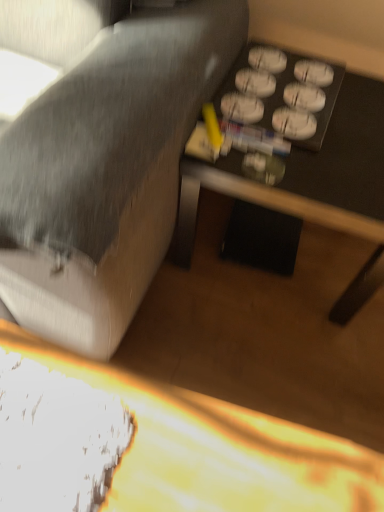
Question: In which direction should I rotate to look at wooden table at center, which is the second table from top to bottom?

Choices:
 (A) right
 (B) left

Answer: (A)

Question: Does black plastic table at lower right, acting as the first table starting from the top, have a greater height compared to wooden table at center, which is the second table from top to bottom?

Choices:
 (A) no
 (B) yes

Answer: (B)

Question: Is black plastic table at lower right, acting as the first table starting from the top, oriented away from wooden table at center, which appears as the first table when ordered from the bottom?

Choices:
 (A) no
 (B) yes

Answer: (A)

Question: Does black plastic table at lower right, the 2th table when ordered from bottom to top, have a smaller size compared to wooden table at center, which is the second table from top to bottom?

Choices:
 (A) yes
 (B) no

Answer: (B)

Question: Considering the relative positions of black plastic table at lower right, the 2th table when ordered from bottom to top, and wooden table at center, which is the second table from top to bottom, in the image provided, is black plastic table at lower right, the 2th table when ordered from bottom to top, to the left of wooden table at center, which is the second table from top to bottom, from the viewer's perspective?

Choices:
 (A) no
 (B) yes

Answer: (A)

Question: From the image's perspective, would you say black plastic table at lower right, acting as the first table starting from the top, is positioned over wooden table at center, which is the second table from top to bottom?

Choices:
 (A) yes
 (B) no

Answer: (A)

Question: Is black plastic table at lower right, the 2th table when ordered from bottom to top, thinner than wooden table at center, which appears as the first table when ordered from the bottom?

Choices:
 (A) yes
 (B) no

Answer: (A)

Question: Is textured gray fabric couch at center in front of wooden table at center, which appears as the first table when ordered from the bottom?

Choices:
 (A) no
 (B) yes

Answer: (B)

Question: Is textured gray fabric couch at center not within wooden table at center, which is the second table from top to bottom?

Choices:
 (A) yes
 (B) no

Answer: (A)

Question: From the image's perspective, is textured gray fabric couch at center located above wooden table at center, which is the second table from top to bottom?

Choices:
 (A) yes
 (B) no

Answer: (A)

Question: Can you confirm if textured gray fabric couch at center is wider than wooden table at center, which appears as the first table when ordered from the bottom?

Choices:
 (A) no
 (B) yes

Answer: (A)

Question: Does textured gray fabric couch at center have a larger size compared to wooden table at center, which is the second table from top to bottom?

Choices:
 (A) yes
 (B) no

Answer: (A)

Question: Is textured gray fabric couch at center shorter than wooden table at center, which appears as the first table when ordered from the bottom?

Choices:
 (A) yes
 (B) no

Answer: (B)

Question: Is textured gray fabric couch at center wider than black plastic table at lower right, acting as the first table starting from the top?

Choices:
 (A) yes
 (B) no

Answer: (A)